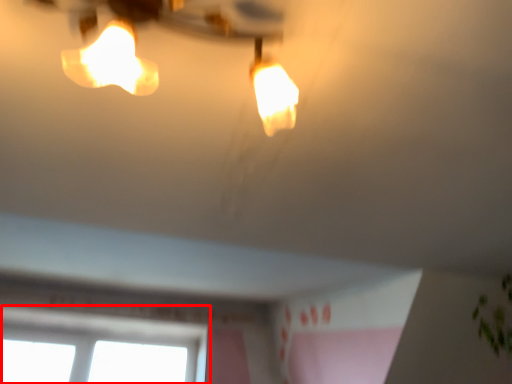
Question: Considering the relative positions of window (annotated by the red box) and lamp in the image provided, where is window (annotated by the red box) located with respect to the staircase?

Choices:
 (A) left
 (B) right

Answer: (A)